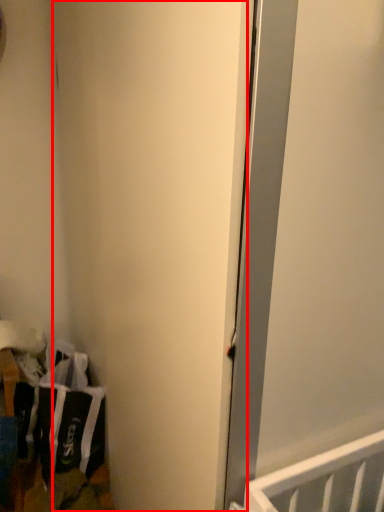
Question: Considering the relative positions of door (annotated by the red box) and laundry in the image provided, where is door (annotated by the red box) located with respect to the staircase?

Choices:
 (A) left
 (B) right

Answer: (B)